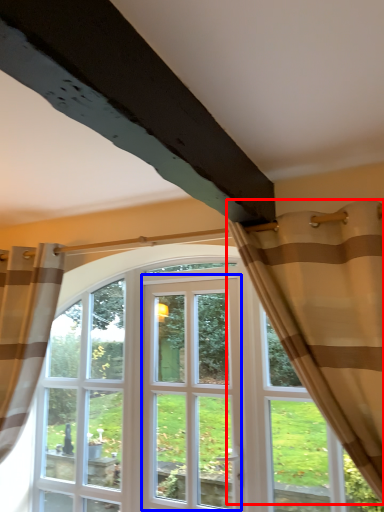
Question: Which object appears closest to the camera in this image, curtain (highlighted by a red box) or screen door (highlighted by a blue box)?

Choices:
 (A) curtain
 (B) screen door

Answer: (A)